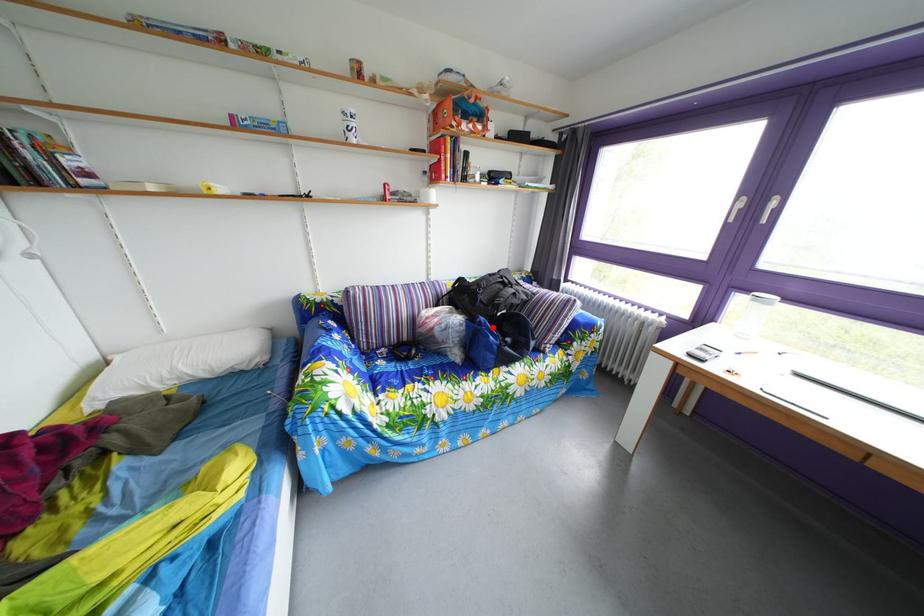
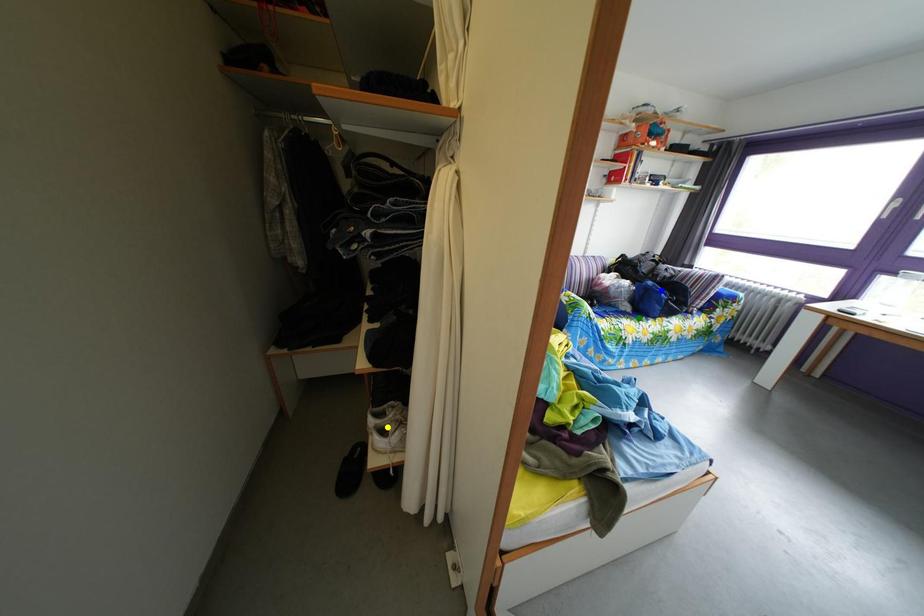
Question: I am providing you with two images of the same scene from different viewpoints. A red point is marked on the first image. You are given multiple points on the second image. Which spot in image 2 lines up with the point in image 1?

Choices:
 (A) blue point
 (B) yellow point
 (C) green point

Answer: (A)